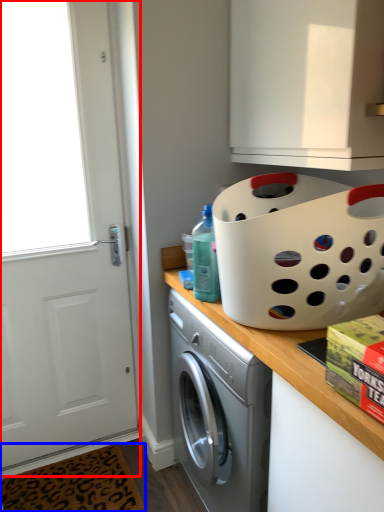
Question: Which point is further to the camera, screen door (highlighted by a red box) or doormat (highlighted by a blue box)?

Choices:
 (A) screen door
 (B) doormat

Answer: (B)